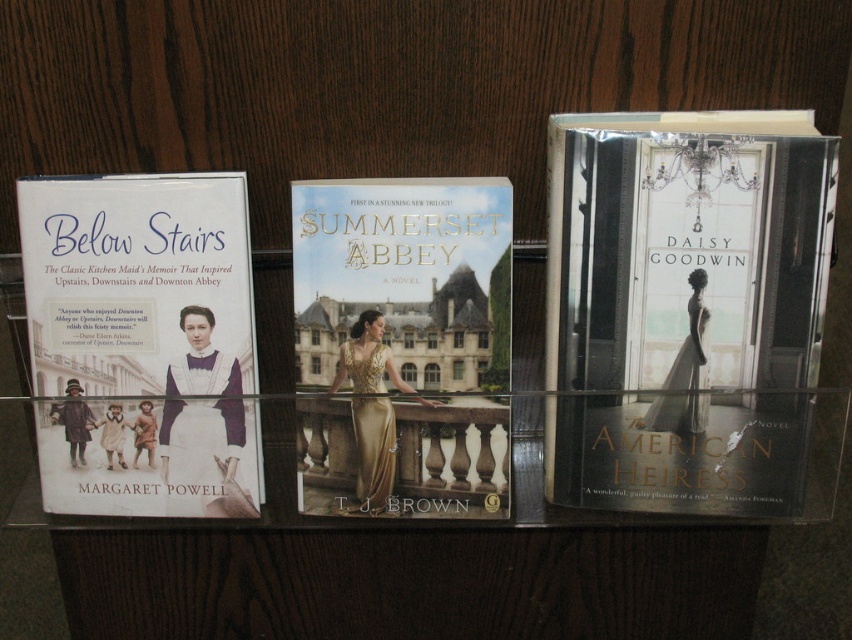
Question: Does matte white book at right lie behind gold fabric book at center?

Choices:
 (A) yes
 (B) no

Answer: (B)

Question: Which point is closer to the camera?

Choices:
 (A) matte white book at left
 (B) matte white book at right
 (C) gold fabric book at center

Answer: (B)

Question: Can you confirm if matte white book at right is smaller than gold fabric book at center?

Choices:
 (A) no
 (B) yes

Answer: (A)

Question: Which is nearer to the matte white book at right?

Choices:
 (A) gold fabric book at center
 (B) matte white book at left

Answer: (A)

Question: Which object is farther from the camera taking this photo?

Choices:
 (A) gold fabric book at center
 (B) matte white book at left
 (C) matte white book at right

Answer: (B)

Question: Does matte white book at right come in front of gold fabric book at center?

Choices:
 (A) no
 (B) yes

Answer: (B)